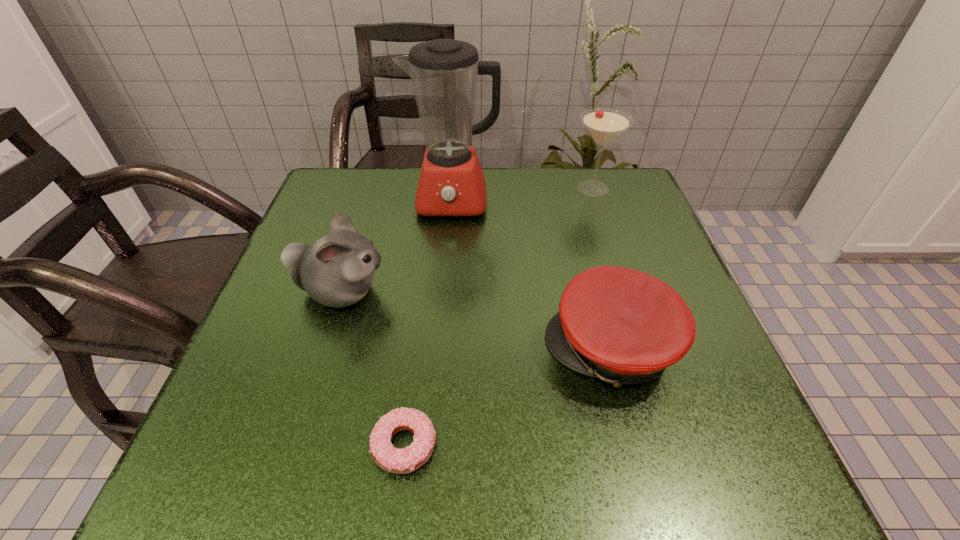
Identify the location of vacant space that's between the hamster and the martini. (467, 241).

Where is `free spot between the nearest object and the second shortest object`? free spot between the nearest object and the second shortest object is located at coordinates (x=508, y=396).

Where is `vacant space in between the blender and the leftmost object`? The height and width of the screenshot is (540, 960). vacant space in between the blender and the leftmost object is located at coordinates (397, 247).

This screenshot has width=960, height=540. In order to click on vacant region between the second tallest object and the tallest object in this screenshot , I will do `click(523, 195)`.

Where is `free space between the blender and the second tallest object`? The image size is (960, 540). free space between the blender and the second tallest object is located at coordinates (523, 195).

This screenshot has width=960, height=540. I want to click on vacant space that's between the blender and the second tallest object, so pyautogui.click(x=523, y=195).

This screenshot has width=960, height=540. I want to click on the third closest object to the blender, so click(623, 326).

Select which object appears as the second closest to the martini. Please provide its 2D coordinates. Your answer should be formatted as a tuple, i.e. [(x, y)], where the tuple contains the x and y coordinates of a point satisfying the conditions above.

[(623, 326)]

I want to click on vacant region that satisfies the following two spatial constraints: 1. on the face of the leftmost object; 2. on the left side of the shortest object, so click(x=294, y=445).

Locate an element on the screen. The image size is (960, 540). free location that satisfies the following two spatial constraints: 1. on the face of the nearest object; 2. on the left side of the third shortest object is located at coordinates (294, 445).